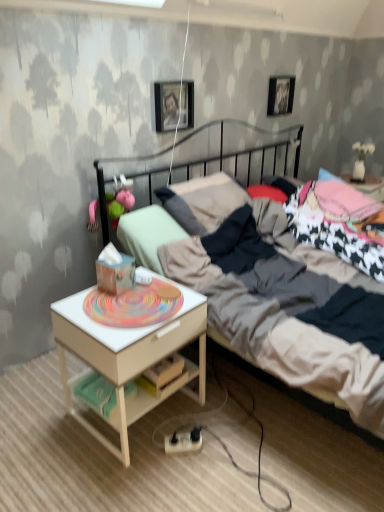
Question: Is metallic photo frame at upper center, the first picture frame in the bottom-to-top sequence, to the left or to the right of white wood nightstand at lower left in the image?

Choices:
 (A) right
 (B) left

Answer: (A)

Question: Relative to white wood nightstand at lower left, is metallic photo frame at upper center, which is counted as the second picture frame, starting from the right, in front or behind?

Choices:
 (A) behind
 (B) front

Answer: (A)

Question: Which of these objects is positioned farthest from the dark gray metal bed at center?

Choices:
 (A) pink fabric toy at left
 (B) white wood nightstand at lower left
 (C) metallic photo frame at upper center, arranged as the second picture frame when viewed from the top
 (D) metallic silver picture frame at upper center, the 1th picture frame from the top

Answer: (D)

Question: Considering the real-world distances, which object is closest to the pink fabric toy at left?

Choices:
 (A) white wood nightstand at lower left
 (B) metallic silver picture frame at upper center, arranged as the first picture frame when viewed from the right
 (C) metallic photo frame at upper center, which is counted as the second picture frame, starting from the right
 (D) dark gray metal bed at center

Answer: (C)